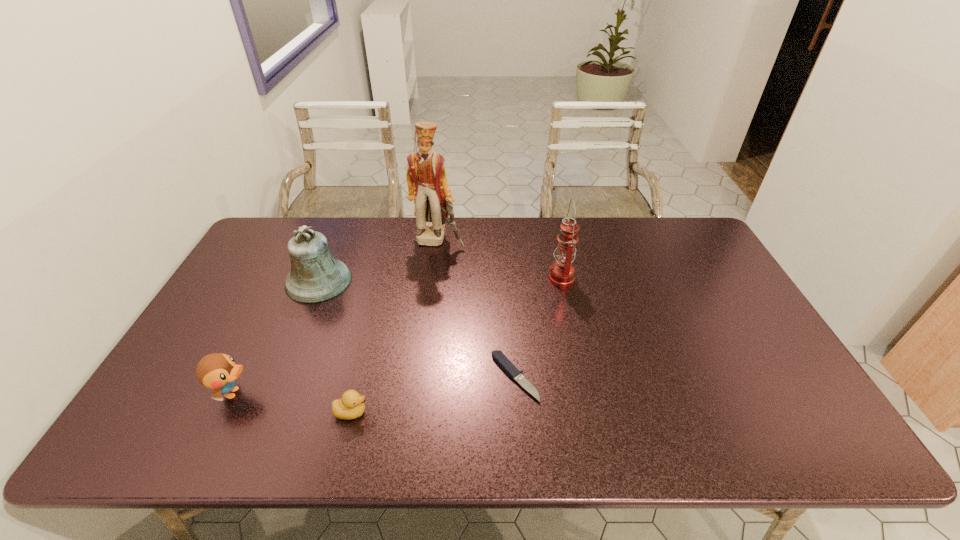
Where is `vacant space positioned on the front-facing side of the farthest object`? The height and width of the screenshot is (540, 960). vacant space positioned on the front-facing side of the farthest object is located at coordinates (433, 280).

Find the location of a particular element. The width and height of the screenshot is (960, 540). vacant space located 0.120m on the front of the oil lamp is located at coordinates (570, 320).

Where is `vacant space situated 0.170m on the right of the third tallest object`? The image size is (960, 540). vacant space situated 0.170m on the right of the third tallest object is located at coordinates (405, 281).

Find the location of a particular element. vacant space situated on the front-facing side of the duck is located at coordinates (386, 393).

In order to click on blank area located 0.380m on the face of the third object from left to right in this screenshot , I will do `click(532, 412)`.

I want to click on vacant region located 0.060m on the right of the shortest object, so click(561, 377).

Locate an element on the screen. The image size is (960, 540). object present at the far edge is located at coordinates (427, 183).

You are a GUI agent. You are given a task and a screenshot of the screen. Output one action in this format:
    pyautogui.click(x=<x>, y=<y>)
    Task: Click on the object that is at the near edge
    Image resolution: width=960 pixels, height=540 pixels.
    Given the screenshot: What is the action you would take?
    pyautogui.click(x=351, y=405)

Locate an element on the screen. This screenshot has height=540, width=960. object located at the left edge is located at coordinates (217, 371).

In the image, there is a desktop. Where is `vacant space at the far edge`? vacant space at the far edge is located at coordinates (491, 226).